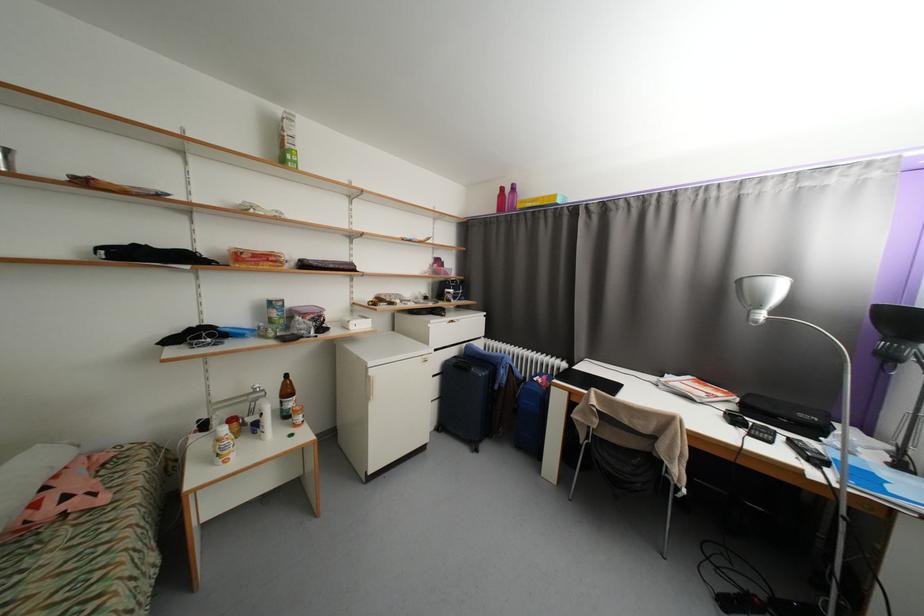
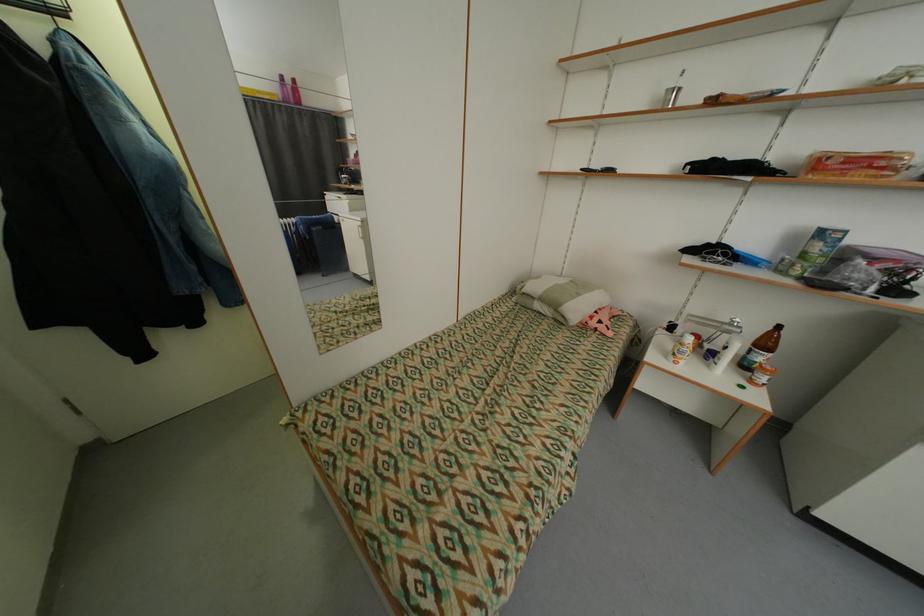
In the second image, find the point that corresponds to point (261, 392) in the first image.

(736, 326)